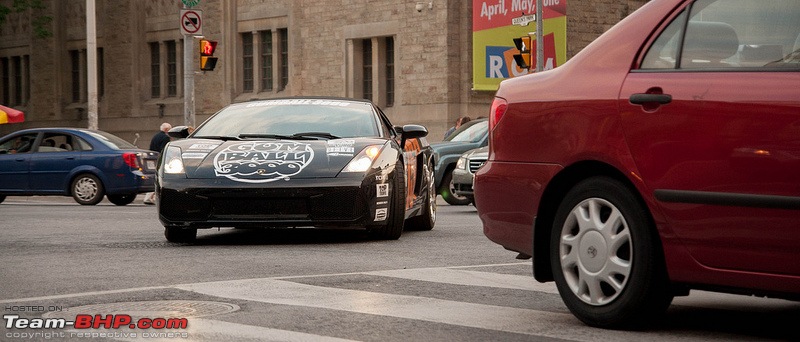
Where is `window`? The height and width of the screenshot is (342, 800). window is located at coordinates (x=254, y=60), (x=74, y=72).